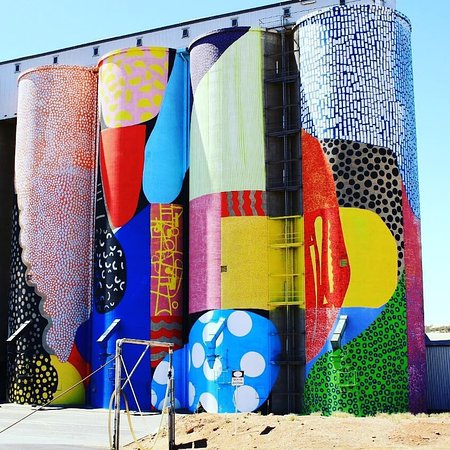
You are a GUI agent. You are given a task and a screenshot of the screen. Output one action in this format:
    pyautogui.click(x=<x>, y=<y>)
    Task: Click on the ladder
    The width and height of the screenshot is (450, 450).
    Given the screenshot: What is the action you would take?
    pyautogui.click(x=288, y=244), pyautogui.click(x=288, y=305)